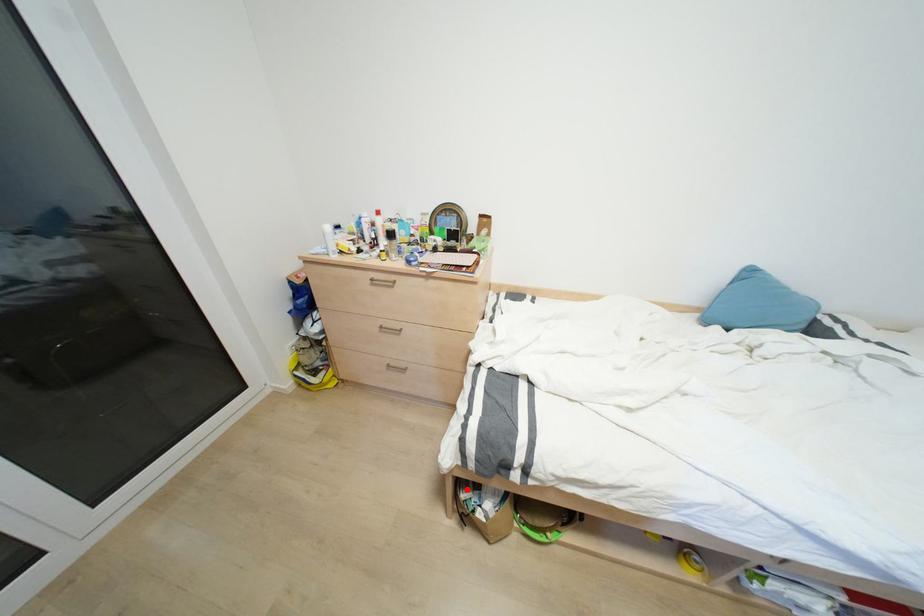
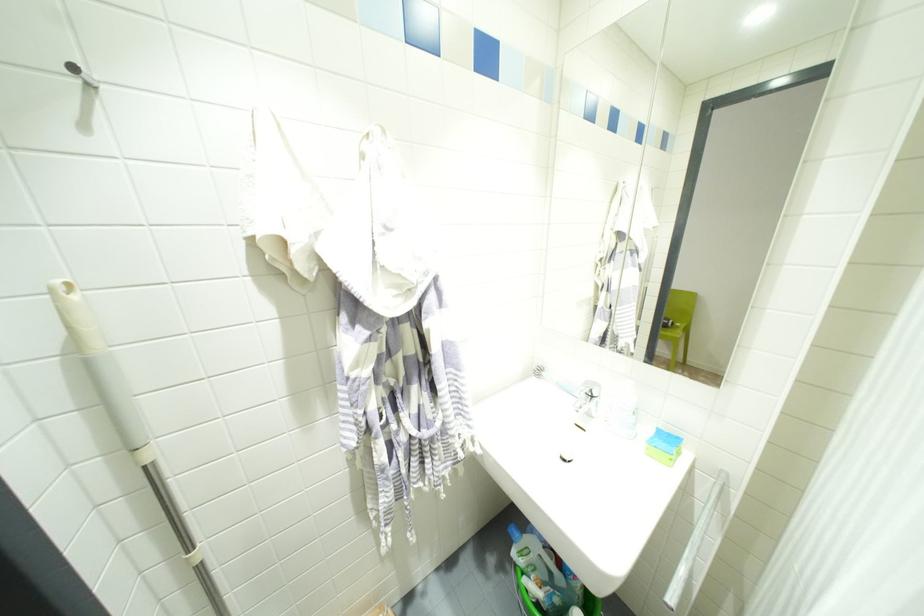
Question: I am providing you with two images of the same scene from different viewpoints. A red point is marked on the first image. At the location where the point appears in image 1, is it still visible in image 2?

Choices:
 (A) Yes
 (B) No

Answer: (B)